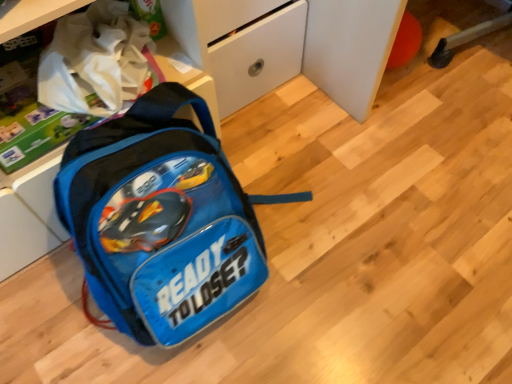
Where is `white matte drawer at center`? white matte drawer at center is located at coordinates (258, 56).

Looking at this image, in order to face white matte drawer at center, should I rotate leftwards or rightwards?

You should look left and rotate roughly 4.671 degrees.

Image resolution: width=512 pixels, height=384 pixels. What do you see at coordinates (258, 56) in the screenshot?
I see `white matte drawer at center` at bounding box center [258, 56].

Consider the image. Measure the distance between point [143,330] and camera.

The distance of point [143,330] from camera is 75.90 centimeters.

What do you see at coordinates (161, 219) in the screenshot? The image size is (512, 384). I see `blue fabric backpack at center` at bounding box center [161, 219].

Locate an element on the screen. This screenshot has width=512, height=384. blue fabric backpack at center is located at coordinates (161, 219).

This screenshot has height=384, width=512. I want to click on white matte drawer at center, so click(258, 56).

Considering the positions of objects blue fabric backpack at center and white matte drawer at center in the image provided, who is more to the left, blue fabric backpack at center or white matte drawer at center?

blue fabric backpack at center.

Does blue fabric backpack at center come in front of white matte drawer at center?

Yes, blue fabric backpack at center is closer to the camera.

Considering the points (90, 147) and (225, 69), which point is in front, point (90, 147) or point (225, 69)?

The point (90, 147) is closer.

From the image's perspective, is blue fabric backpack at center above or below white matte drawer at center?

Clearly, from the image's perspective, blue fabric backpack at center is below white matte drawer at center.

From a real-world perspective, is blue fabric backpack at center physically below white matte drawer at center?

Yes, from a real-world perspective, blue fabric backpack at center is under white matte drawer at center.

Which of these two, blue fabric backpack at center or white matte drawer at center, is thinner?

white matte drawer at center.

Does blue fabric backpack at center have a greater height compared to white matte drawer at center?

In fact, blue fabric backpack at center may be shorter than white matte drawer at center.

Considering the sizes of objects blue fabric backpack at center and white matte drawer at center in the image provided, who is bigger, blue fabric backpack at center or white matte drawer at center?

blue fabric backpack at center.

In the scene shown: Does blue fabric backpack at center contain white matte drawer at center?

Actually, white matte drawer at center is outside blue fabric backpack at center.

Is there a large distance between blue fabric backpack at center and white matte drawer at center?

blue fabric backpack at center is actually quite close to white matte drawer at center.

Is blue fabric backpack at center facing towards white matte drawer at center?

No, blue fabric backpack at center is not turned towards white matte drawer at center.

Where is `backpack lying on the left of white matte drawer at center`? backpack lying on the left of white matte drawer at center is located at coordinates (161, 219).

Would you say white matte drawer at center is to the left or to the right of blue fabric backpack at center in the picture?

Clearly, white matte drawer at center is on the right of blue fabric backpack at center in the image.

Is white matte drawer at center positioned in front of blue fabric backpack at center?

No, white matte drawer at center is behind blue fabric backpack at center.

Between point (281, 37) and point (189, 311), which one is positioned in front?

Point (189, 311)

From the image's perspective, between white matte drawer at center and blue fabric backpack at center, who is located below?

blue fabric backpack at center, from the image's perspective.

From the picture: From a real-world perspective, is white matte drawer at center positioned under blue fabric backpack at center based on gravity?

No, from a real-world perspective, white matte drawer at center is not below blue fabric backpack at center.

Considering the sizes of objects white matte drawer at center and blue fabric backpack at center in the image provided, who is wider, white matte drawer at center or blue fabric backpack at center?

With larger width is blue fabric backpack at center.

Is white matte drawer at center shorter than blue fabric backpack at center?

In fact, white matte drawer at center may be taller than blue fabric backpack at center.

Is white matte drawer at center bigger than blue fabric backpack at center?

No, white matte drawer at center is not bigger than blue fabric backpack at center.

From the picture: Would you say white matte drawer at center is outside blue fabric backpack at center?

Indeed, white matte drawer at center is completely outside blue fabric backpack at center.

Is the surface of white matte drawer at center in direct contact with blue fabric backpack at center?

There is a gap between white matte drawer at center and blue fabric backpack at center.

Looking at this image, is blue fabric backpack at center at the back of white matte drawer at center?

No, white matte drawer at center is not facing away from blue fabric backpack at center.

Locate an element on the screen. backpack that is on the left side of white matte drawer at center is located at coordinates (161, 219).

In order to click on drawer above the blue fabric backpack at center (from a real-world perspective) in this screenshot , I will do `click(258, 56)`.

Find the location of a particular element. This screenshot has height=384, width=512. backpack below the white matte drawer at center (from the image's perspective) is located at coordinates (161, 219).